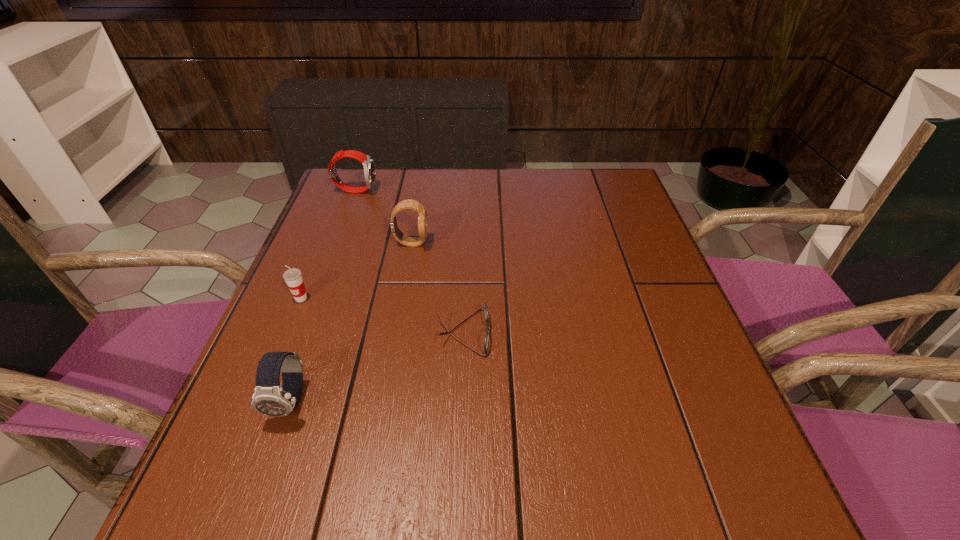
At what (x,y) coordinates should I click in order to perform the action: click on free space that satisfies the following two spatial constraints: 1. on the front-facing side of the second nearest object; 2. on the face of the nearest object. Please return your answer as a coordinate pair (x, y). This screenshot has width=960, height=540. Looking at the image, I should click on (461, 401).

Where is `free region that satisfies the following two spatial constraints: 1. on the face of the rightmost watch; 2. on the side of the cup with the logo`? free region that satisfies the following two spatial constraints: 1. on the face of the rightmost watch; 2. on the side of the cup with the logo is located at coordinates (401, 298).

Locate an element on the screen. blank area in the image that satisfies the following two spatial constraints: 1. on the face of the rightmost watch; 2. on the face of the nearest watch is located at coordinates [x=382, y=401].